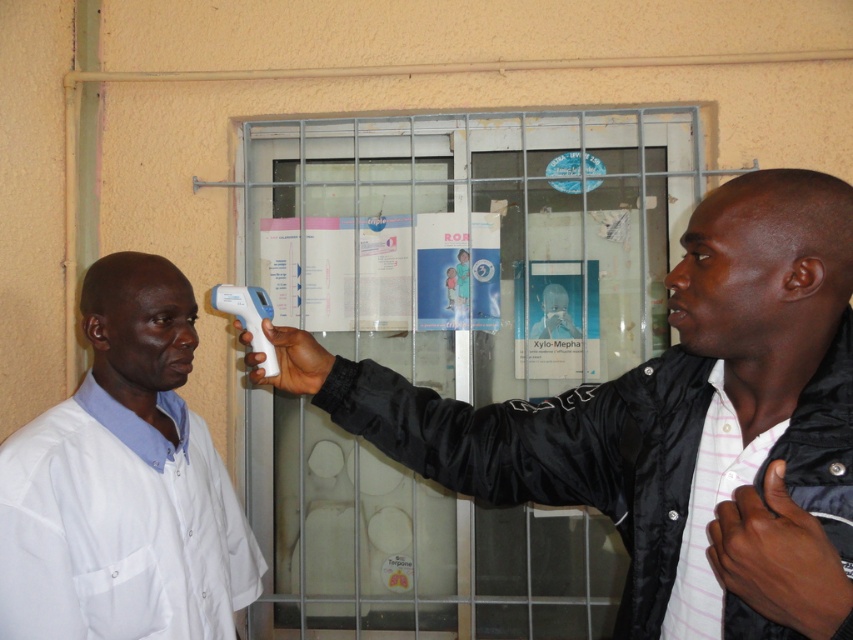
Question: Which point appears farthest from the camera in this image?

Choices:
 (A) (129, 269)
 (B) (807, 269)

Answer: (A)

Question: Does white matte thermometer at center have a smaller size compared to white matte lab coat at left?

Choices:
 (A) yes
 (B) no

Answer: (B)

Question: Does white matte thermometer at center appear under white matte lab coat at left?

Choices:
 (A) no
 (B) yes

Answer: (A)

Question: Can you confirm if white matte thermometer at center is smaller than white matte lab coat at left?

Choices:
 (A) yes
 (B) no

Answer: (B)